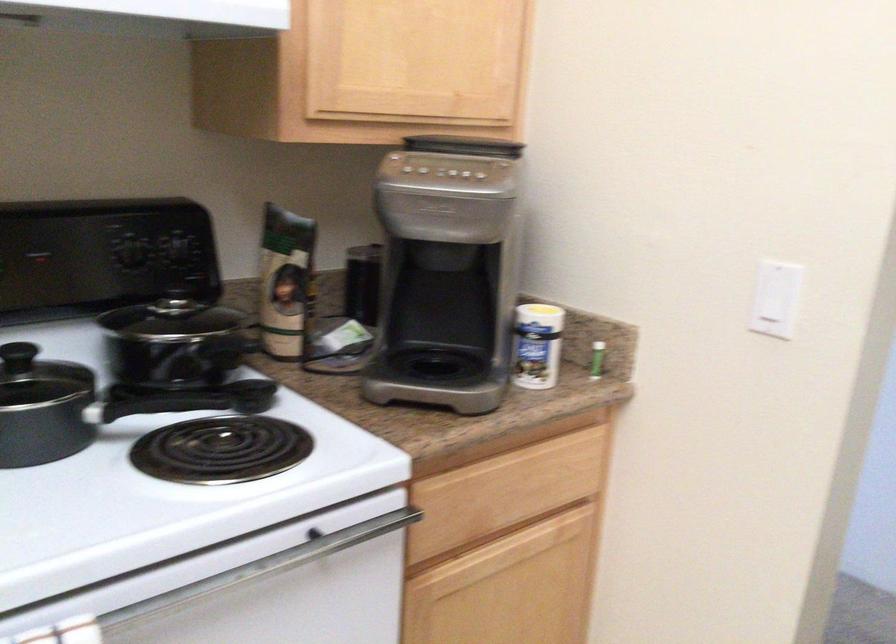
What do you see at coordinates (463, 146) in the screenshot?
I see `a coffee maker lid` at bounding box center [463, 146].